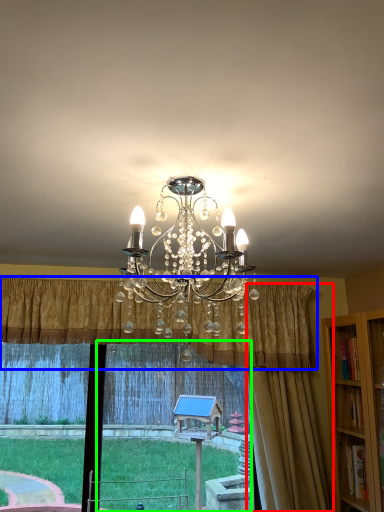
Question: Considering the real-world distances, which object is farthest from curtain (highlighted by a red box)? curtain (highlighted by a blue box) or window frame (highlighted by a green box)?

Choices:
 (A) curtain
 (B) window frame

Answer: (B)